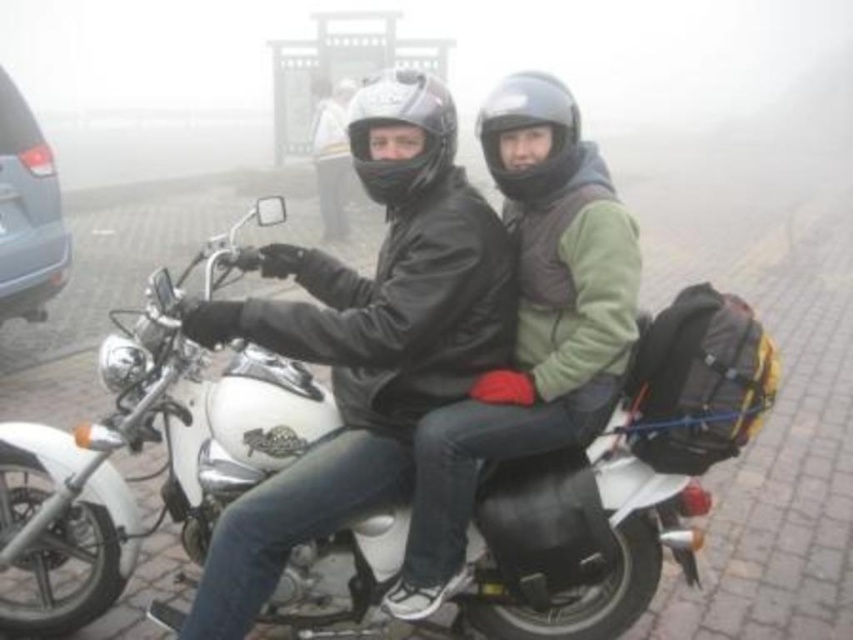
Is point (33, 273) closer to viewer compared to point (424, 128)?

That is False.

This screenshot has width=853, height=640. Identify the location of metallic gray van at left. (27, 212).

In the scene shown: Between textured fabric backpack at rear and glossy black helmet at center, which one appears on the left side from the viewer's perspective?

glossy black helmet at center is more to the left.

Who is taller, textured fabric backpack at rear or glossy black helmet at center?

With more height is textured fabric backpack at rear.

Locate an element on the screen. This screenshot has height=640, width=853. textured fabric backpack at rear is located at coordinates (698, 381).

Does matte black motorcycle at center have a greater height compared to glossy black helmet at center?

Yes.

Can you confirm if matte black motorcycle at center is positioned to the left of glossy black helmet at center?

Indeed, matte black motorcycle at center is positioned on the left side of glossy black helmet at center.

Between point (431, 262) and point (450, 138), which one is positioned behind?

The point (450, 138) is more distant.

Locate an element on the screen. Image resolution: width=853 pixels, height=640 pixels. matte black motorcycle at center is located at coordinates (412, 352).